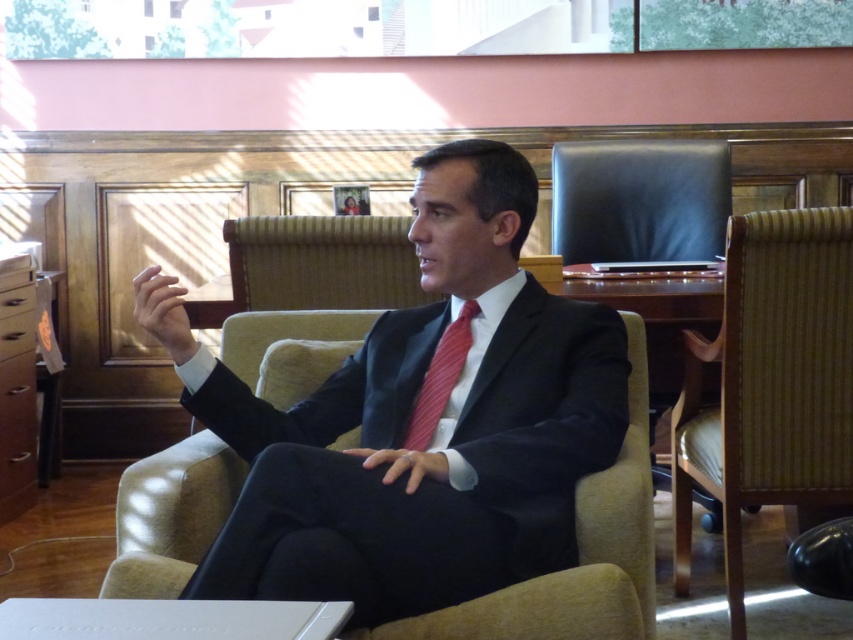
Does dark blue suit at center have a smaller size compared to red striped tie at center?

No, dark blue suit at center is not smaller than red striped tie at center.

What do you see at coordinates (426, 472) in the screenshot? The width and height of the screenshot is (853, 640). I see `dark blue suit at center` at bounding box center [426, 472].

What do you see at coordinates (426, 472) in the screenshot? I see `dark blue suit at center` at bounding box center [426, 472].

Where is `dark blue suit at center`? This screenshot has height=640, width=853. dark blue suit at center is located at coordinates (426, 472).

Is woven fabric swivel chair at right thinner than red striped tie at center?

In fact, woven fabric swivel chair at right might be wider than red striped tie at center.

Is woven fabric swivel chair at right positioned before red striped tie at center?

That is False.

Where is `woven fabric swivel chair at right`? This screenshot has width=853, height=640. woven fabric swivel chair at right is located at coordinates (769, 381).

Who is higher up, dark blue suit at center or woven fabric swivel chair at right?

→ dark blue suit at center is higher up.

The height and width of the screenshot is (640, 853). Describe the element at coordinates (426, 472) in the screenshot. I see `dark blue suit at center` at that location.

You are a GUI agent. You are given a task and a screenshot of the screen. Output one action in this format:
    pyautogui.click(x=<x>, y=<y>)
    Task: Click on the dark blue suit at center
    
    Given the screenshot: What is the action you would take?
    pyautogui.click(x=426, y=472)